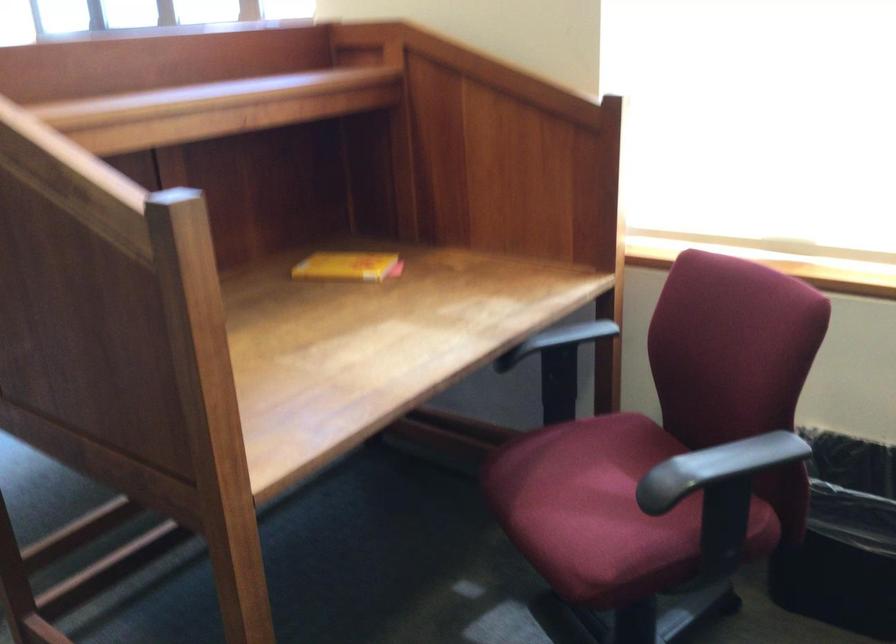
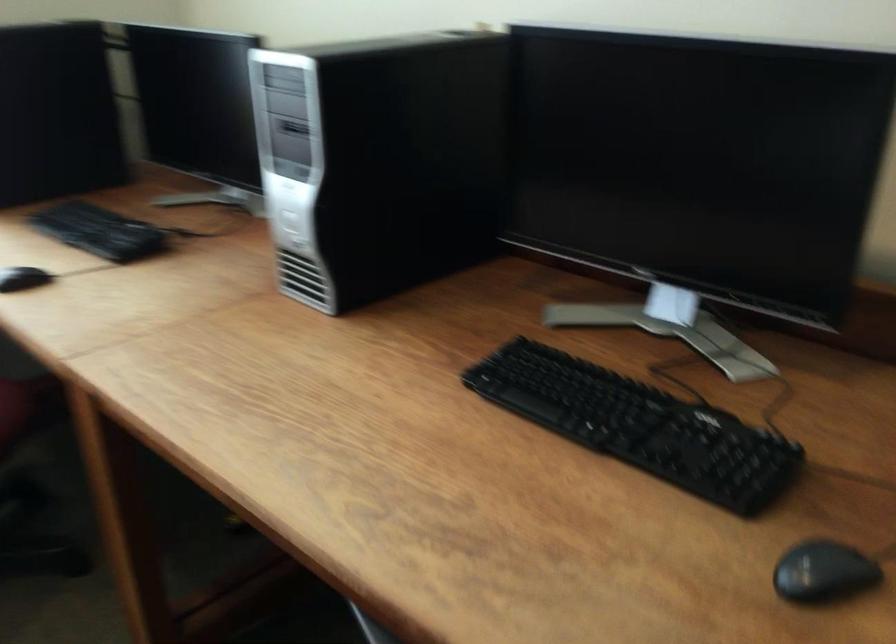
The images are taken continuously from a first-person perspective. In which direction is your viewpoint rotating?

The camera's rotation is toward right-down.